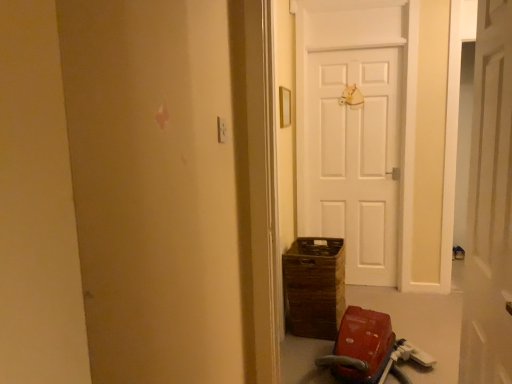
Question: Is white matte door at center in front of or behind red plastic baby carriage at lower right in the image?

Choices:
 (A) behind
 (B) front

Answer: (B)

Question: From the image's perspective, relative to red plastic baby carriage at lower right, is white matte door at center above or below?

Choices:
 (A) above
 (B) below

Answer: (A)

Question: Is white matte door at center bigger or smaller than red plastic baby carriage at lower right?

Choices:
 (A) small
 (B) big

Answer: (A)

Question: Is red plastic baby carriage at lower right inside the boundaries of white matte door at center, or outside?

Choices:
 (A) inside
 (B) outside

Answer: (B)

Question: Relative to white matte door at center, is red plastic baby carriage at lower right in front or behind?

Choices:
 (A) front
 (B) behind

Answer: (B)

Question: Is point (346, 380) closer or farther from the camera than point (488, 347)?

Choices:
 (A) farther
 (B) closer

Answer: (A)

Question: From a real-world perspective, is red plastic baby carriage at lower right above or below white matte door at center?

Choices:
 (A) above
 (B) below

Answer: (B)